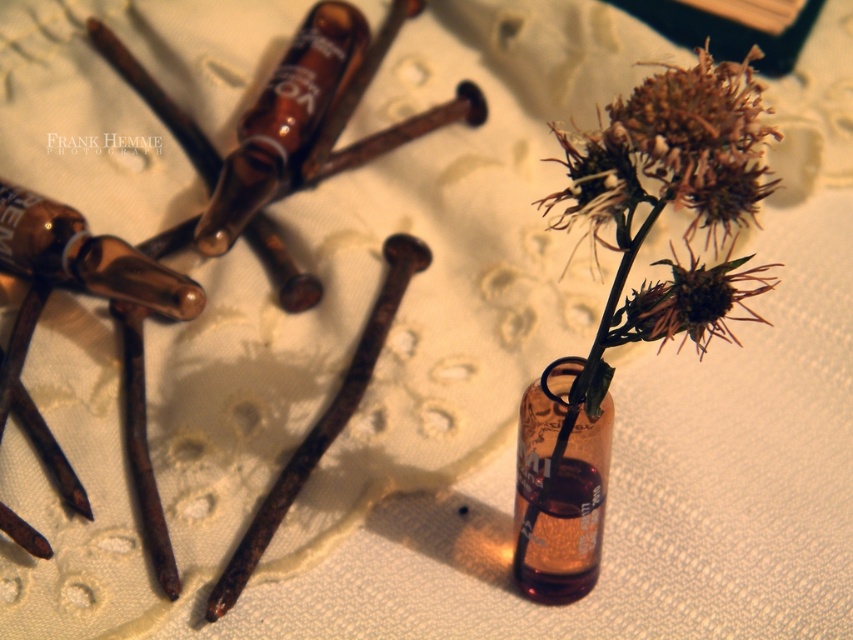
Question: Among these points, which one is nearest to the camera?

Choices:
 (A) coord(618,189)
 (B) coord(1,237)

Answer: (A)

Question: Considering the relative positions of brown glass bottle at upper left and matte brown glass bottle at left in the image provided, where is brown glass bottle at upper left located with respect to matte brown glass bottle at left?

Choices:
 (A) below
 (B) above

Answer: (B)

Question: Which is nearer to the brown spiky thistle at center?

Choices:
 (A) brown glass bottle at upper left
 (B) brown matte thistle at center
 (C) matte brown glass bottle at left

Answer: (B)

Question: Can you confirm if brown matte thistle at center is positioned above matte brown glass bottle at left?

Choices:
 (A) yes
 (B) no

Answer: (A)

Question: Which point is farther to the camera?

Choices:
 (A) brown matte thistle at center
 (B) brown spiky thistle at center
 (C) matte brown glass bottle at left
 (D) brown glass bottle at upper left

Answer: (D)

Question: Does brown glass bottle at upper left have a smaller size compared to matte brown glass bottle at left?

Choices:
 (A) yes
 (B) no

Answer: (B)